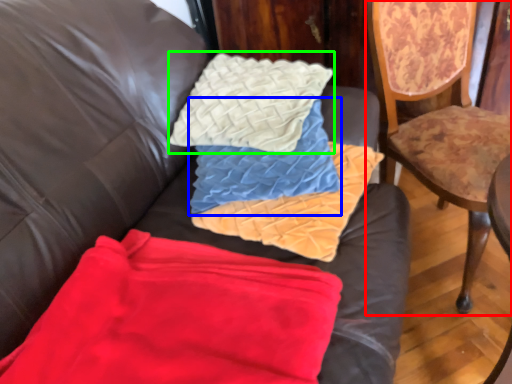
Question: Based on their relative distances, which object is nearer to chair (highlighted by a red box)? Choose from pillow (highlighted by a blue box) and throw pillow (highlighted by a green box).

Choices:
 (A) pillow
 (B) throw pillow

Answer: (B)